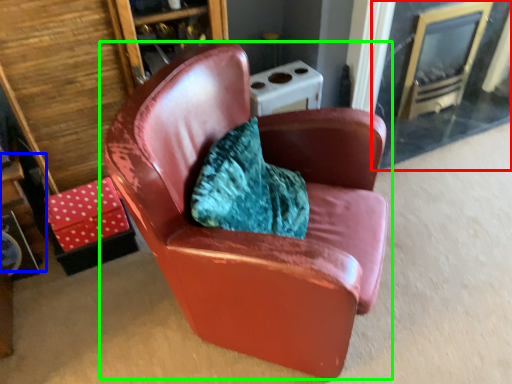
Question: Which is nearer to the glass door (highlighted by a red box)? table (highlighted by a blue box) or chair (highlighted by a green box).

Choices:
 (A) table
 (B) chair

Answer: (B)